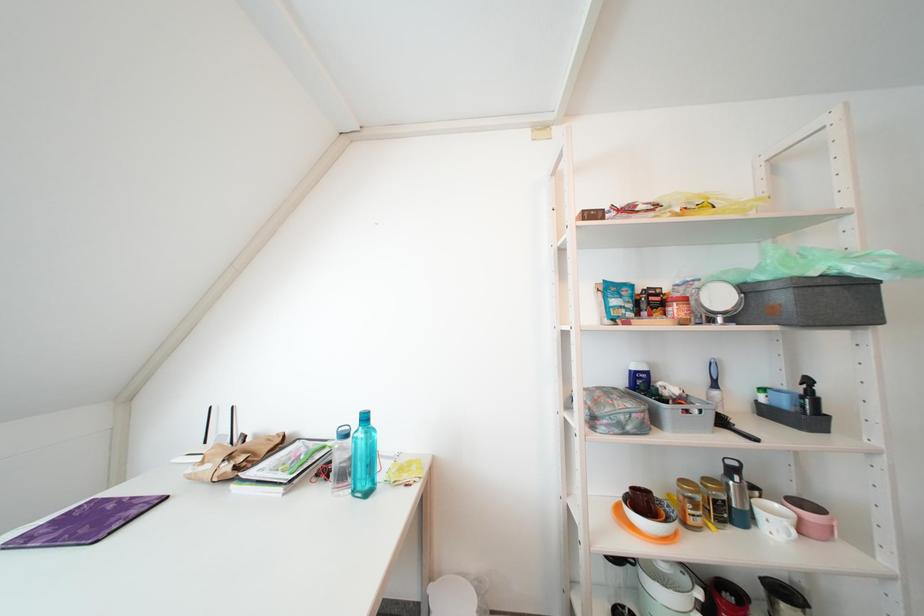
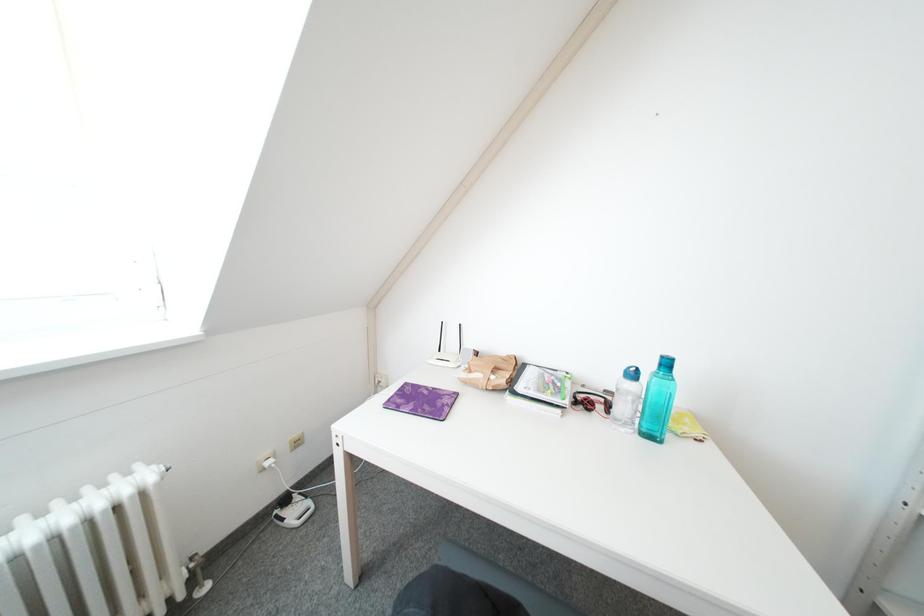
Question: Which direction would the cameraman need to move to produce the second image? Reply with the corresponding letter.

Choices:
 (A) Left
 (B) Right
 (C) Forward
 (D) Backward

Answer: (A)